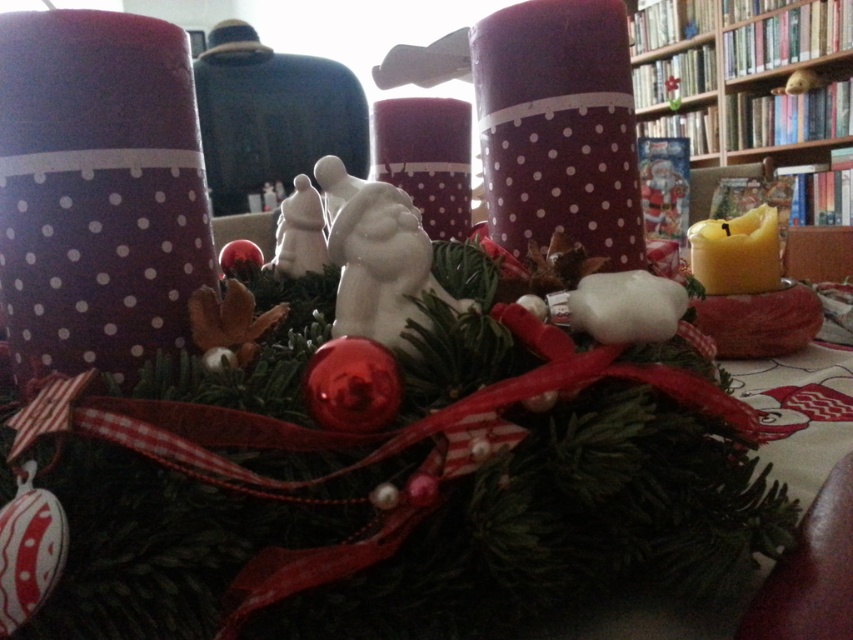
Question: Considering the real-world distances, which object is farthest from the wooden bookshelf at upper right?

Choices:
 (A) yellow wax candle at right
 (B) matte polka dot candle at center
 (C) green matte wreath at center

Answer: (C)

Question: Which object is the farthest from the matte polka dot candle at center?

Choices:
 (A) wooden bookshelf at upper right
 (B) green matte wreath at center

Answer: (A)

Question: Where is green matte wreath at center located in relation to wooden bookshelf at upper right in the image?

Choices:
 (A) left
 (B) right

Answer: (A)

Question: From the image, what is the correct spatial relationship of wooden bookshelf at upper right in relation to matte polka dot candle at center?

Choices:
 (A) above
 (B) below

Answer: (A)

Question: Is green matte wreath at center thinner than matte polka dot candle at center?

Choices:
 (A) no
 (B) yes

Answer: (A)

Question: Among these objects, which one is nearest to the camera?

Choices:
 (A) matte polka dot candle at center
 (B) yellow wax candle at right

Answer: (A)